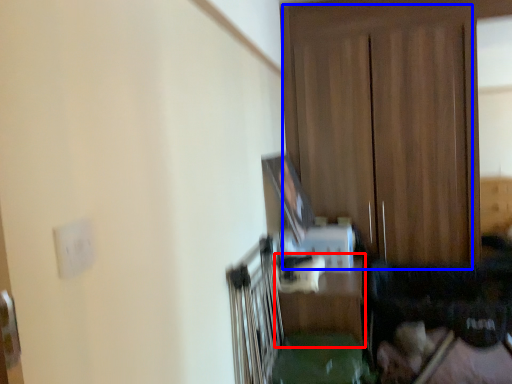
Question: Among these objects, which one is nearest to the camera, table (highlighted by a red box) or dresser (highlighted by a blue box)?

Choices:
 (A) table
 (B) dresser

Answer: (A)